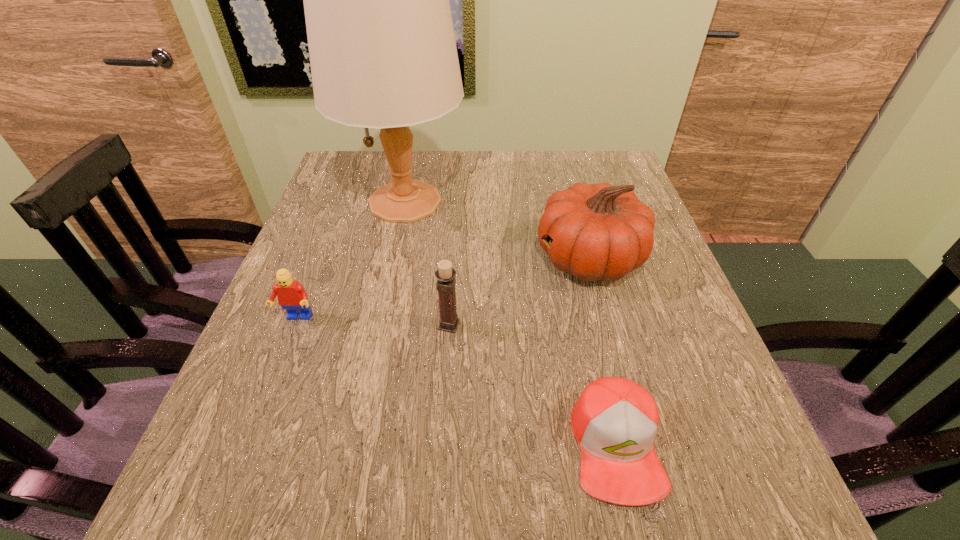
You are a GUI agent. You are given a task and a screenshot of the screen. Output one action in this format:
    pyautogui.click(x=<x>, y=<y>)
    Task: Click on the tallest object
    
    Given the screenshot: What is the action you would take?
    pyautogui.click(x=383, y=55)

The width and height of the screenshot is (960, 540). I want to click on pumpkin, so click(602, 232).

You are a GUI agent. You are given a task and a screenshot of the screen. Output one action in this format:
    pyautogui.click(x=<x>, y=<y>)
    Task: Click on the third tallest object
    
    Given the screenshot: What is the action you would take?
    click(445, 274)

Where is `the fourth tallest object`? This screenshot has width=960, height=540. the fourth tallest object is located at coordinates (291, 295).

Where is `baseball cap`? The width and height of the screenshot is (960, 540). baseball cap is located at coordinates (615, 421).

What are the coordinates of `the nearest object` in the screenshot? It's located at (615, 421).

At what (x,y) coordinates should I click in order to perform the action: click on vacant region located 0.120m on the right of the table lamp. Please return your answer as a coordinate pair (x, y). Looking at the image, I should click on (514, 202).

Locate an element on the screen. Image resolution: width=960 pixels, height=540 pixels. vacant space located on the face of the pumpkin is located at coordinates (486, 259).

Where is `vacant position located on the face of the pumpkin`? This screenshot has height=540, width=960. vacant position located on the face of the pumpkin is located at coordinates (404, 259).

Where is `vacant space located 0.400m on the face of the pumpkin`? vacant space located 0.400m on the face of the pumpkin is located at coordinates (354, 259).